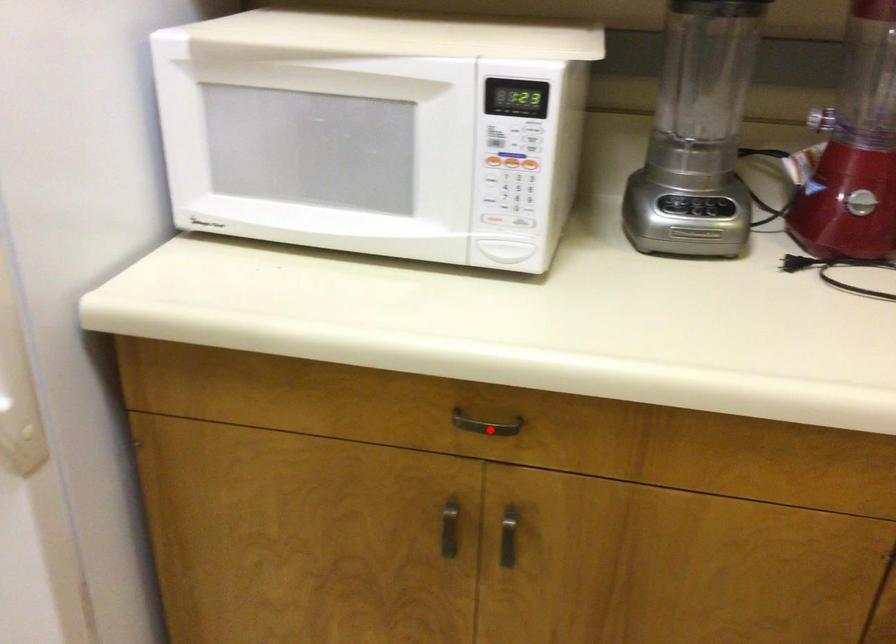
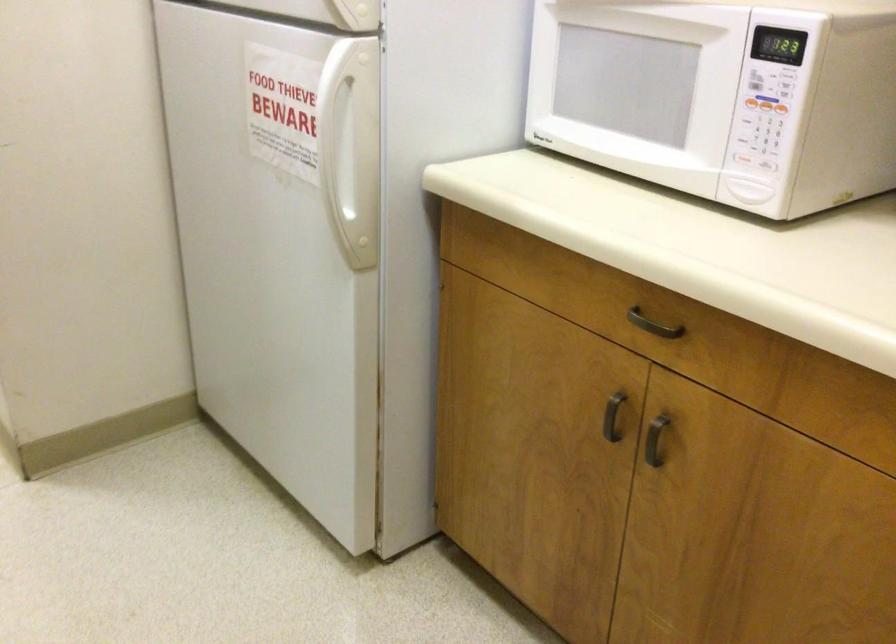
Question: I am providing you with two images of the same scene from different viewpoints. A red point is marked on the first image. At the location where the point appears in image 1, is it still visible in image 2?

Choices:
 (A) Yes
 (B) No

Answer: (A)